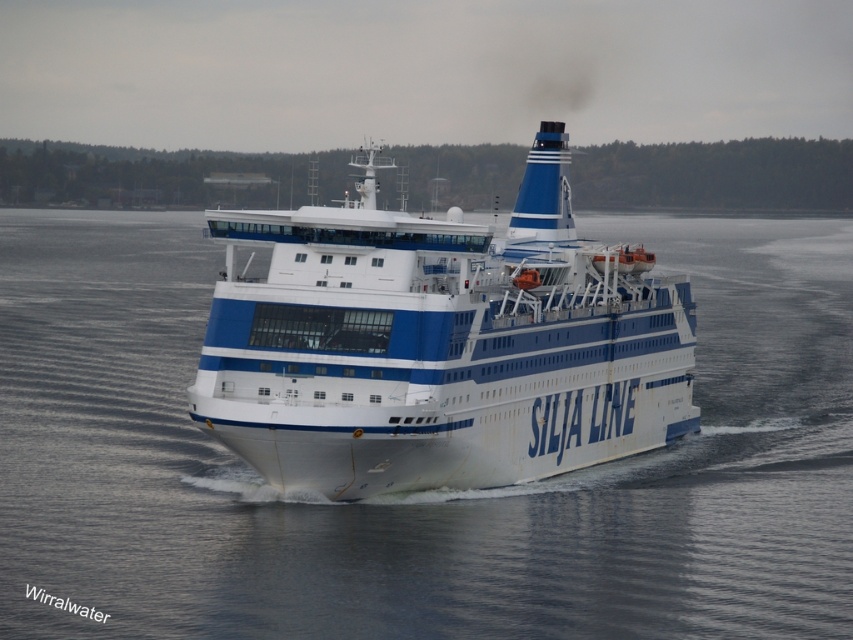
Question: Among these points, which one is farthest from the camera?

Choices:
 (A) (271, 518)
 (B) (457, 292)

Answer: (B)

Question: Which of the following is the closest to the observer?

Choices:
 (A) (347, 305)
 (B) (55, 268)

Answer: (A)

Question: Is white water at center bigger than white glossy ferry at center?

Choices:
 (A) no
 (B) yes

Answer: (B)

Question: Is white water at center to the right of white glossy ferry at center from the viewer's perspective?

Choices:
 (A) no
 (B) yes

Answer: (A)

Question: Which point is farther to the camera?

Choices:
 (A) white water at center
 (B) white glossy ferry at center

Answer: (B)

Question: Does white water at center appear under white glossy ferry at center?

Choices:
 (A) no
 (B) yes

Answer: (B)